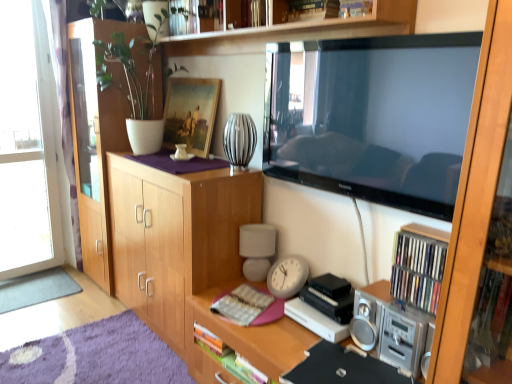
Locate an element on the screen. vacant space situated above gray carpet at lower left (from a real-world perspective) is located at coordinates (30, 286).